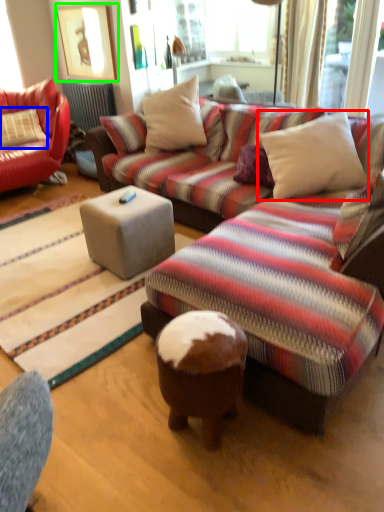
Question: Which is nearer to the pillow (highlighted by a red box)? pillow (highlighted by a blue box) or picture frame (highlighted by a green box).

Choices:
 (A) pillow
 (B) picture frame

Answer: (A)